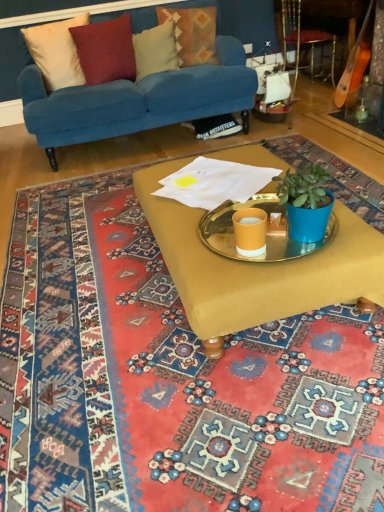
Locate an element on the screen. free space in front of matte gold coffee table at center is located at coordinates click(211, 422).